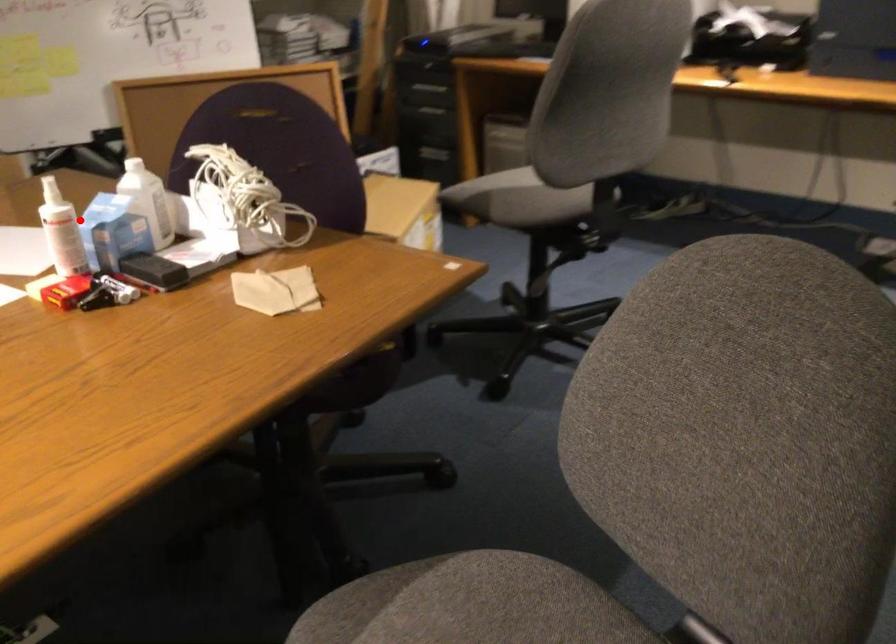
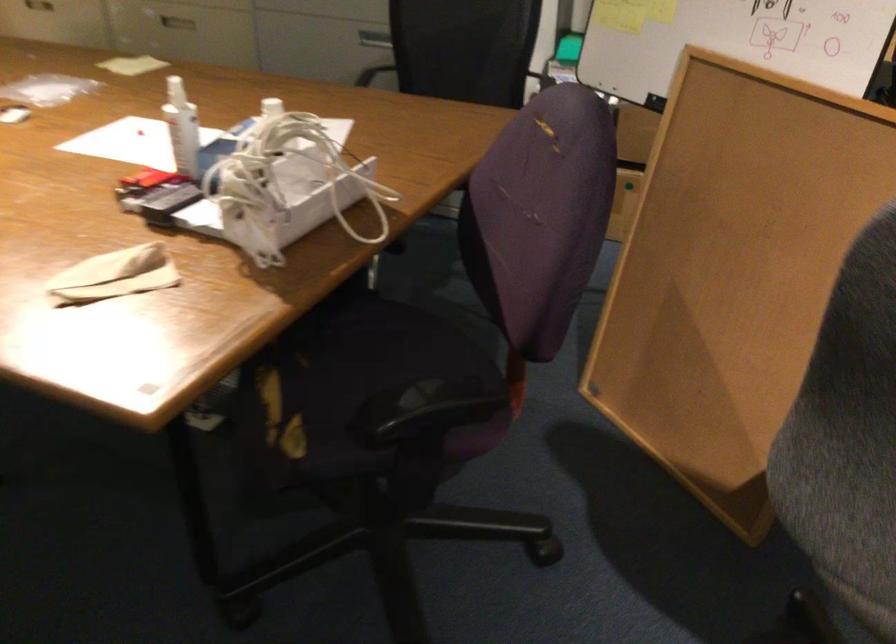
Find the pixel in the second image that matches the highlighted location in the first image.

(182, 128)